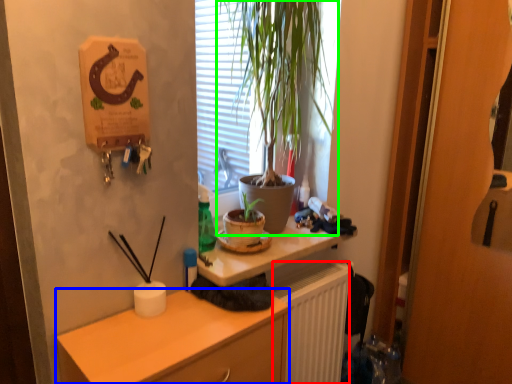
Question: Which object is positioned closest to radiator (highlighted by a red box)? Select from cabinetry (highlighted by a blue box) and houseplant (highlighted by a green box).

Choices:
 (A) cabinetry
 (B) houseplant

Answer: (A)